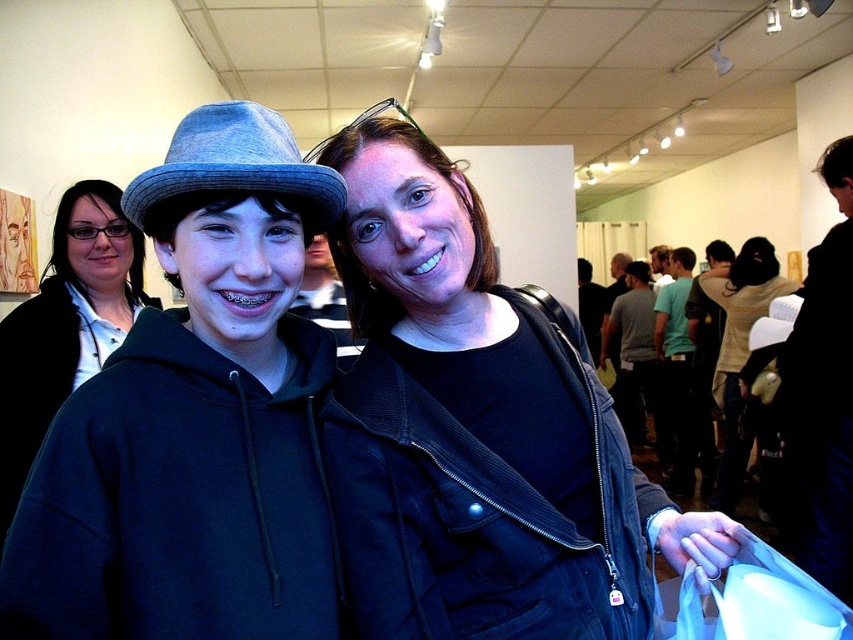
Is black corduroy jacket at center bigger than matte gray hat at center?

Yes, black corduroy jacket at center is bigger than matte gray hat at center.

Does black corduroy jacket at center have a greater width compared to matte gray hat at center?

Yes.

Image resolution: width=853 pixels, height=640 pixels. I want to click on black corduroy jacket at center, so click(476, 429).

You are a GUI agent. You are given a task and a screenshot of the screen. Output one action in this format:
    pyautogui.click(x=<x>, y=<y>)
    Task: Click on the black corduroy jacket at center
    The height and width of the screenshot is (640, 853).
    Given the screenshot: What is the action you would take?
    pyautogui.click(x=476, y=429)

Which of these two, matte gray hat at center or gray cotton t-shirt at center-right, stands taller?

gray cotton t-shirt at center-right is taller.

You are a GUI agent. You are given a task and a screenshot of the screen. Output one action in this format:
    pyautogui.click(x=<x>, y=<y>)
    Task: Click on the matte gray hat at center
    
    Given the screenshot: What is the action you would take?
    pyautogui.click(x=195, y=419)

Who is shorter, black corduroy jacket at center or light beige sweater at center?

black corduroy jacket at center

Is black corduroy jacket at center closer to camera compared to light beige sweater at center?

Yes.

At what (x,y) coordinates should I click in order to perform the action: click on black corduroy jacket at center. Please return your answer as a coordinate pair (x, y). The height and width of the screenshot is (640, 853). Looking at the image, I should click on (476, 429).